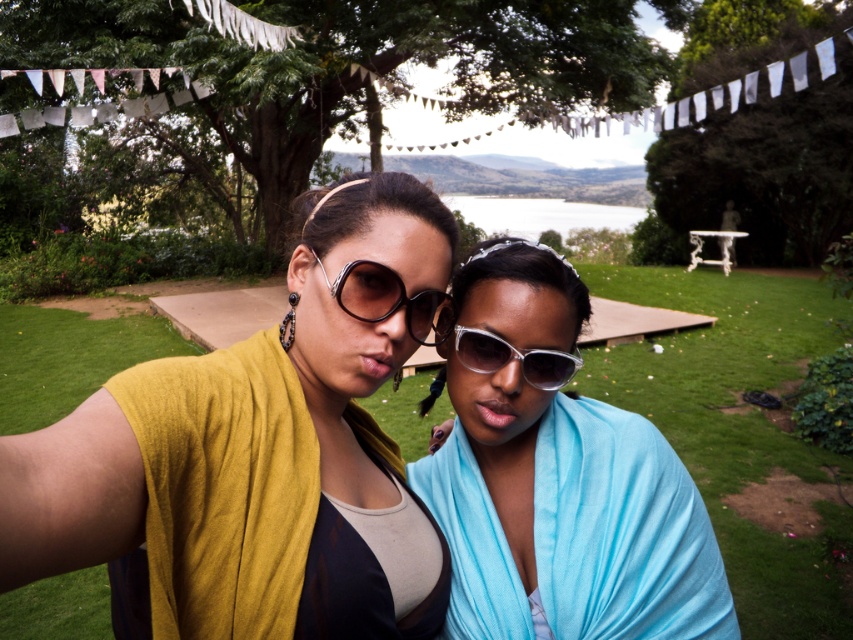
You are trying to locate the matte black sunglasses at center in the image. According to the coordinates provided, where would you look first?

You should look at point (x=392, y=300) to find the matte black sunglasses at center.

You are trying to decide which pair of sunglasses to take for a hike. Both matte black sunglasses at center and transparent plastic sunglasses at center are in front of you. If you want the wider option, which pair should you choose?

The matte black sunglasses at center is wider than the transparent plastic sunglasses at center, so you should choose the matte black sunglasses at center.